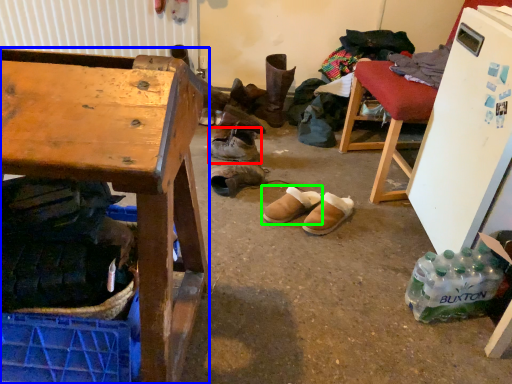
Question: Which is farther away from footwear (highlighted by a red box)? desk (highlighted by a blue box) or footwear (highlighted by a green box)?

Choices:
 (A) desk
 (B) footwear

Answer: (A)